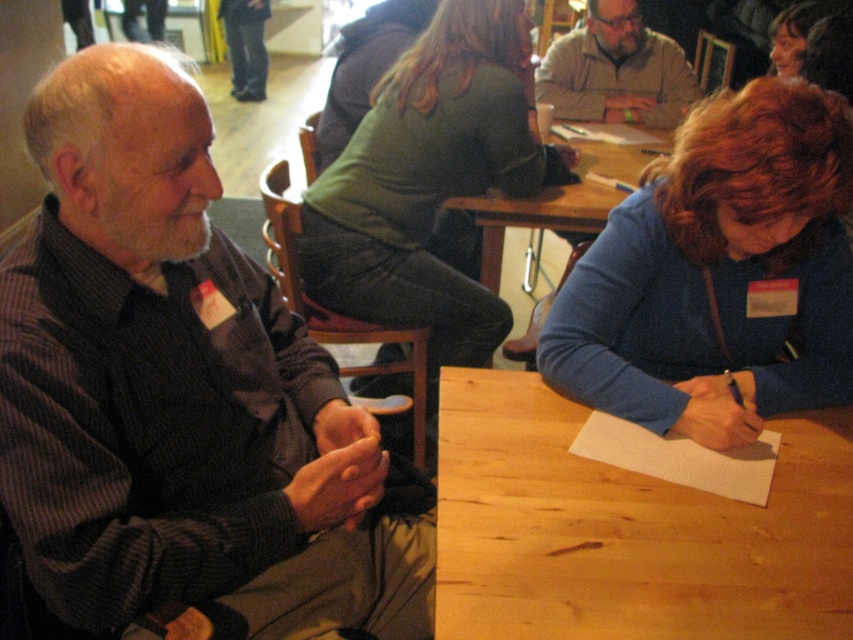
Question: Considering the relative positions of dark brown textured sweater at left and green jersey at center in the image provided, where is dark brown textured sweater at left located with respect to green jersey at center?

Choices:
 (A) right
 (B) left

Answer: (B)

Question: Which object is positioned farthest from the dark brown textured sweater at left?

Choices:
 (A) white lined paper at lower center
 (B) light brown wood at lower right
 (C) light gray sweater at center
 (D) wooden table at center

Answer: (C)

Question: Which of the following is the farthest from the observer?

Choices:
 (A) wooden table at center
 (B) white lined paper at lower center

Answer: (A)

Question: Is dark brown textured sweater at left below white lined paper at lower center?

Choices:
 (A) no
 (B) yes

Answer: (A)

Question: Is wooden table at center bigger than white lined paper at lower center?

Choices:
 (A) no
 (B) yes

Answer: (B)

Question: Which object is closer to the camera taking this photo?

Choices:
 (A) wooden table at center
 (B) dark brown textured sweater at left
 (C) light gray sweater at center

Answer: (B)